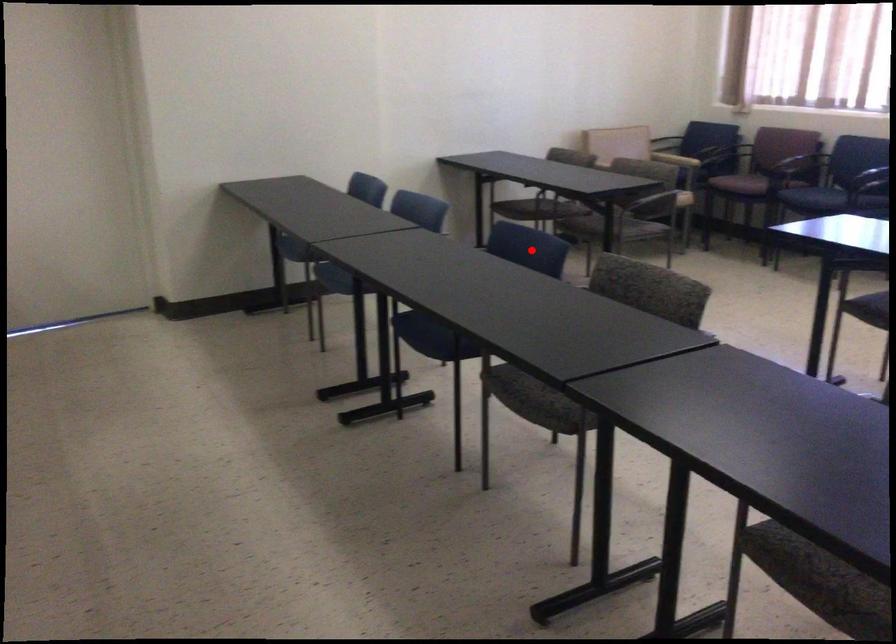
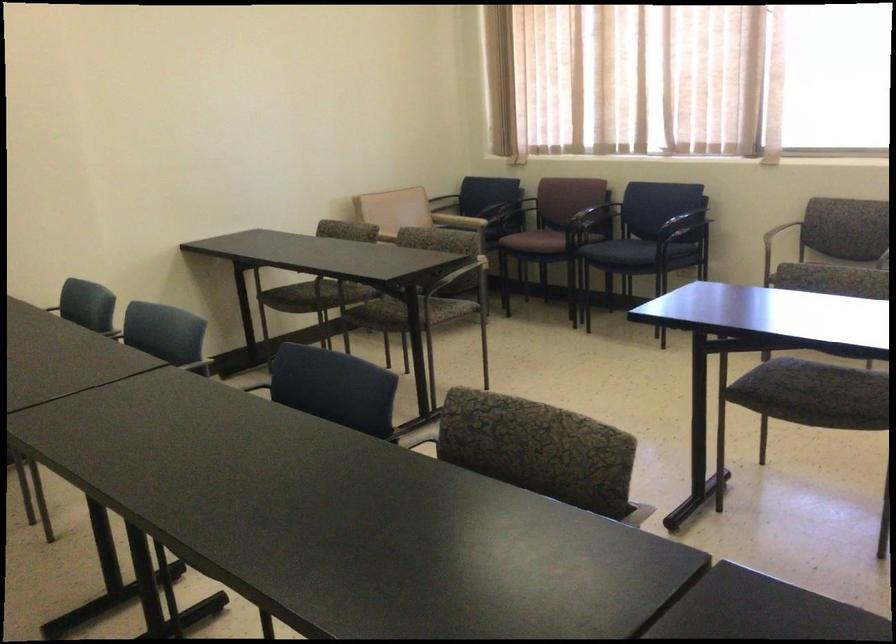
Locate, in the second image, the point that corresponds to the highlighted location in the first image.

(332, 386)